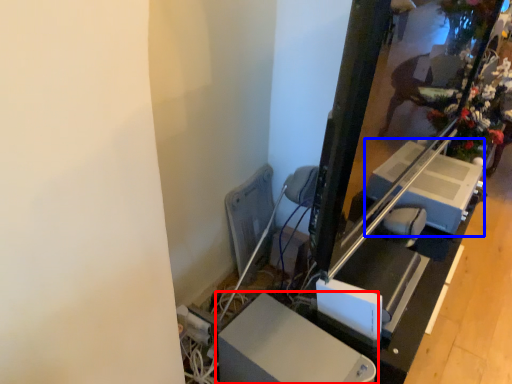
Question: Which point is further to the camera, furniture (highlighted by a red box) or lift (highlighted by a blue box)?

Choices:
 (A) furniture
 (B) lift

Answer: (B)